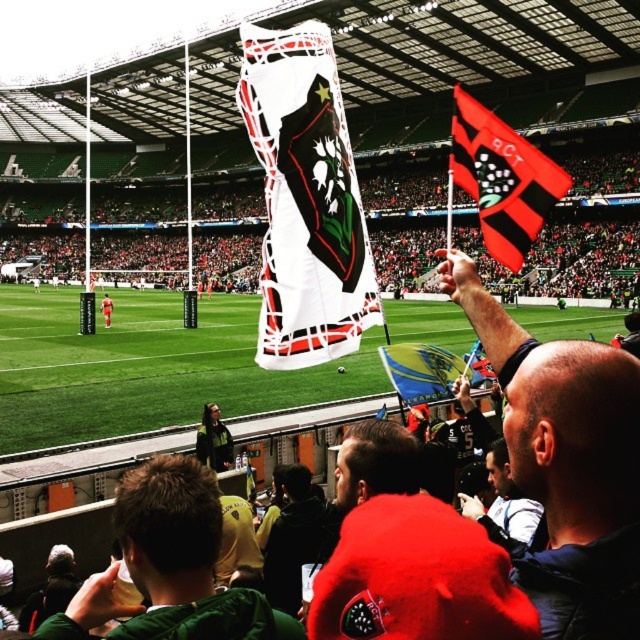
Which is more to the right, green grass football field at center or white matte flag at center?

white matte flag at center

Does point (246, 346) come in front of point (241, 76)?

That is False.

Between point (275, 392) and point (291, 92), which one is positioned behind?

Point (275, 392)

Where is `green grass football field at center`? This screenshot has height=640, width=640. green grass football field at center is located at coordinates (147, 368).

Based on the photo, is green grass football field at center positioned at the back of red fabric flag at upper right?

Yes, green grass football field at center is behind red fabric flag at upper right.

Between point (193, 400) and point (454, 168), which one is positioned behind?

The point (193, 400) is more distant.

Locate an element on the screen. This screenshot has height=640, width=640. green grass football field at center is located at coordinates (147, 368).

Where is `white matte flag at center`? white matte flag at center is located at coordinates (305, 200).

Is white matte flag at center bigger than red fabric flag at upper right?

Actually, white matte flag at center might be smaller than red fabric flag at upper right.

This screenshot has height=640, width=640. In order to click on white matte flag at center in this screenshot , I will do `click(305, 200)`.